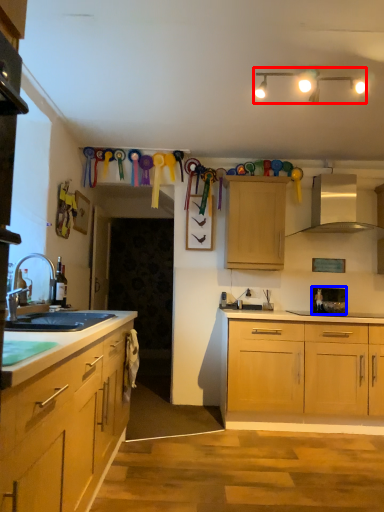
Question: Among these objects, which one is nearest to the camera, lamp (highlighted by a red box) or appliance (highlighted by a blue box)?

Choices:
 (A) lamp
 (B) appliance

Answer: (A)